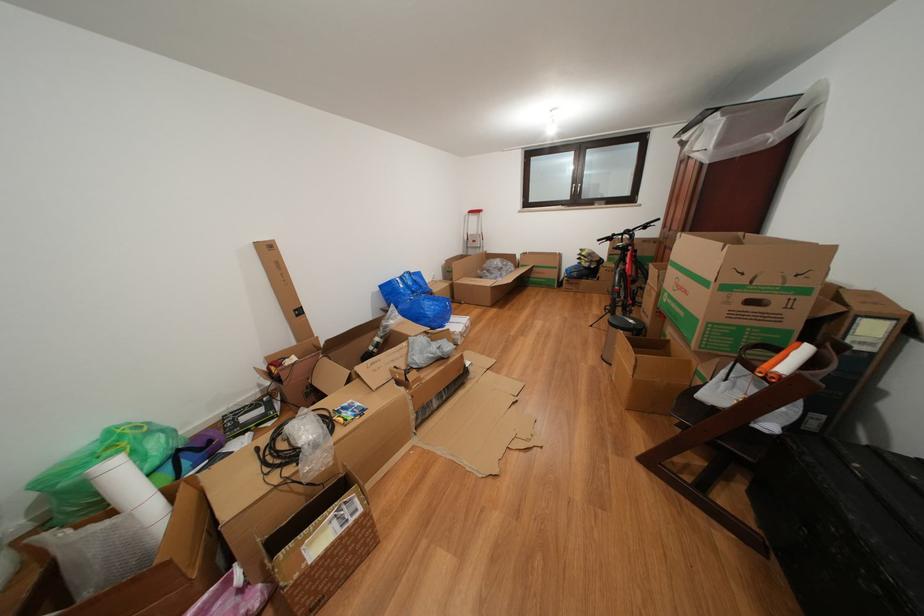
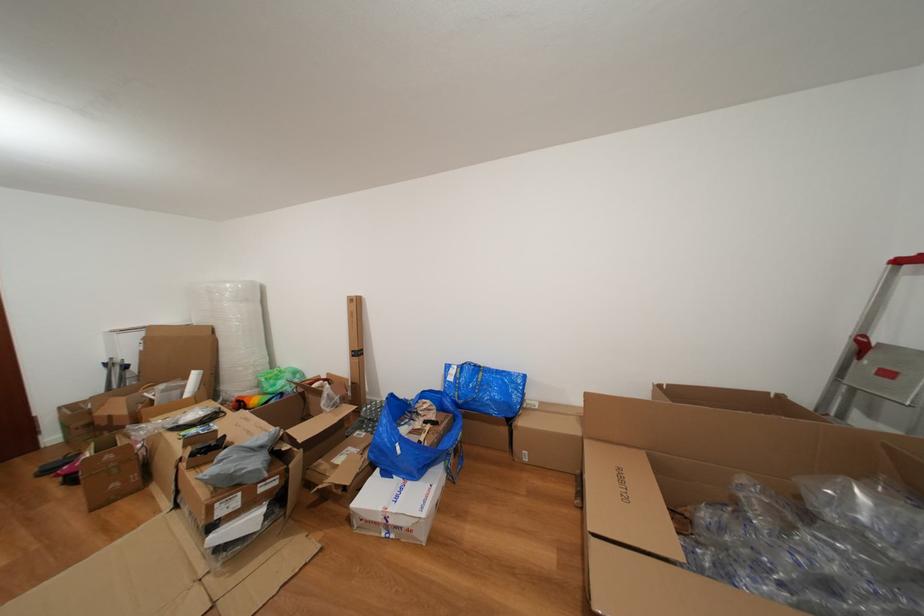
Locate, in the second image, the point that corresponds to (x=451, y=331) in the first image.

(394, 479)